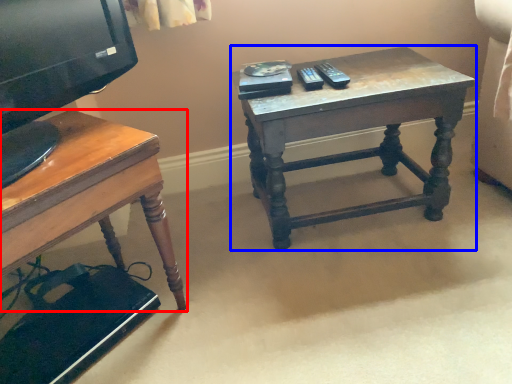
Question: Which object appears farthest to the camera in this image, desk (highlighted by a red box) or table (highlighted by a blue box)?

Choices:
 (A) desk
 (B) table

Answer: (B)